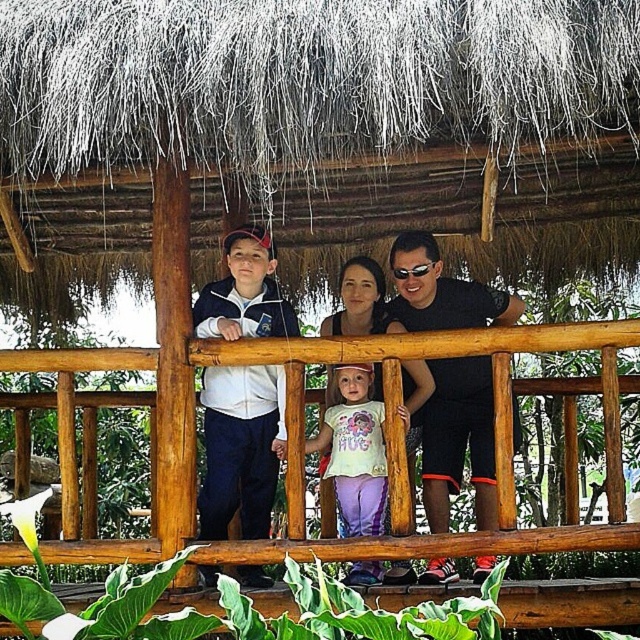
Question: Which point is farther from the camera taking this photo?

Choices:
 (A) (392, 410)
 (B) (241, 400)
 (C) (353, 408)

Answer: (C)

Question: Can you confirm if wooden at center is bigger than light purple fabric pants at center?

Choices:
 (A) yes
 (B) no

Answer: (A)

Question: In this image, where is wooden at center located relative to black matte shirt at center?

Choices:
 (A) above
 (B) below

Answer: (B)

Question: Which object appears closest to the camera in this image?

Choices:
 (A) light purple fabric pants at center
 (B) matte white jacket at center
 (C) black matte shirt at center
 (D) wooden at center

Answer: (D)

Question: Is matte white jacket at center in front of matte white hoodie at center?

Choices:
 (A) no
 (B) yes

Answer: (B)

Question: Which point is farther to the camera?

Choices:
 (A) (332, 316)
 (B) (378, 452)

Answer: (A)